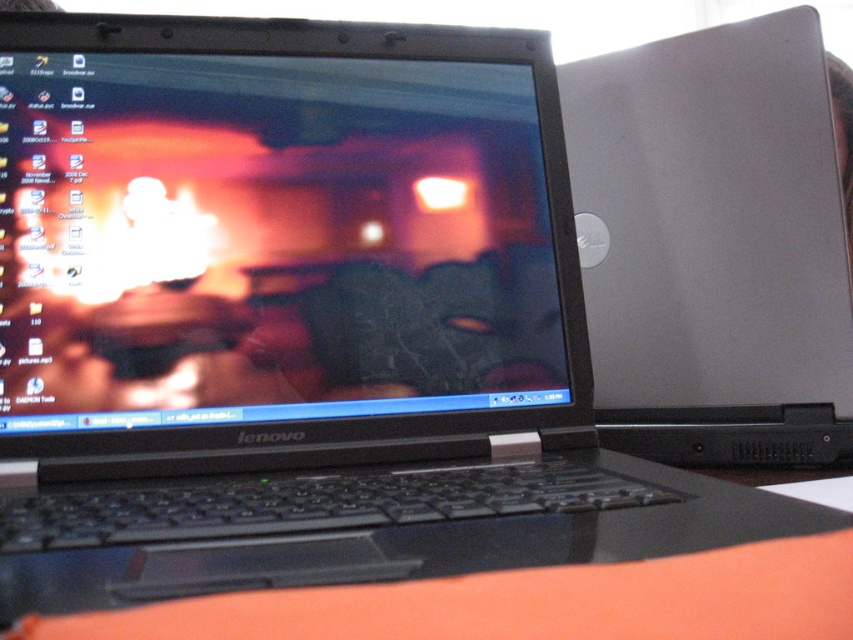
Question: Is silver metallic laptop at right smaller than orange fabric at lower center?

Choices:
 (A) yes
 (B) no

Answer: (B)

Question: Can you confirm if matte black laptop at center is positioned to the right of silver metallic laptop at right?

Choices:
 (A) no
 (B) yes

Answer: (A)

Question: Considering the real-world distances, which object is closest to the orange fabric at lower center?

Choices:
 (A) silver metallic laptop at right
 (B) matte black laptop at center

Answer: (B)

Question: Which point is farther to the camera?

Choices:
 (A) (120, 365)
 (B) (202, 532)

Answer: (A)

Question: Which of the following is the closest to the observer?

Choices:
 (A) orange fabric at lower center
 (B) matte black laptop at center

Answer: (A)

Question: Does matte black laptop at center have a lesser width compared to orange fabric at lower center?

Choices:
 (A) no
 (B) yes

Answer: (B)